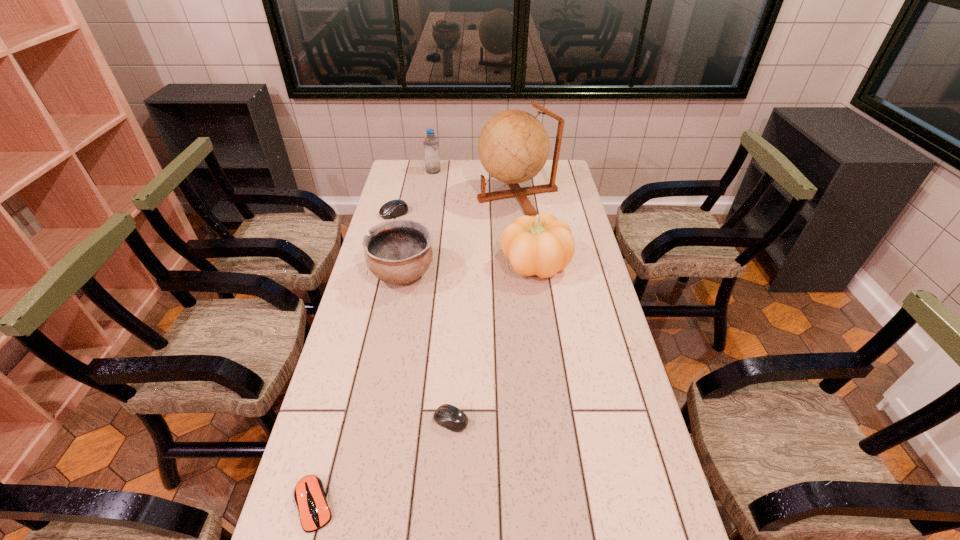
Identify the location of vacant space located 0.220m on the surface of the globe. (426, 195).

Find the location of a particular element. free space located 0.390m on the surface of the globe is located at coordinates (387, 195).

This screenshot has width=960, height=540. I want to click on blank space located 0.190m on the surface of the globe, so click(x=433, y=195).

Identify the location of free spot located 0.220m on the front of the water bottle. The image size is (960, 540). (428, 200).

What are the coordinates of `free space located on the front of the pumpkin` in the screenshot? It's located at (541, 305).

Where is `free space located 0.070m on the back of the pottery`? The height and width of the screenshot is (540, 960). free space located 0.070m on the back of the pottery is located at coordinates (409, 241).

Where is `free space located 0.250m on the back of the farther black mouse`? This screenshot has height=540, width=960. free space located 0.250m on the back of the farther black mouse is located at coordinates (403, 177).

Locate an element on the screen. vacant region located on the front of the fifth object from left to right is located at coordinates (445, 521).

Where is `vacant point located 0.250m on the right of the shortest computer mouse`? The height and width of the screenshot is (540, 960). vacant point located 0.250m on the right of the shortest computer mouse is located at coordinates (450, 504).

Where is `globe that is at the far edge`? The width and height of the screenshot is (960, 540). globe that is at the far edge is located at coordinates (513, 146).